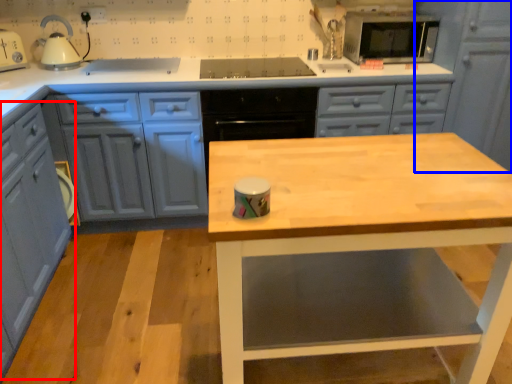
Question: Which object is further to the camera taking this photo, cabinetry (highlighted by a red box) or cabinetry (highlighted by a blue box)?

Choices:
 (A) cabinetry
 (B) cabinetry

Answer: (B)